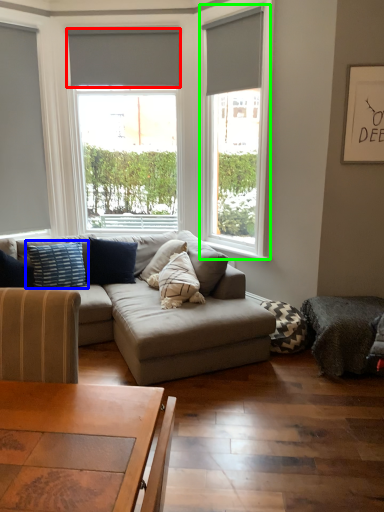
Question: Which object is the closest to the blind (highlighted by a red box)? Choose among these: pillow (highlighted by a blue box) or window (highlighted by a green box).

Choices:
 (A) pillow
 (B) window

Answer: (B)